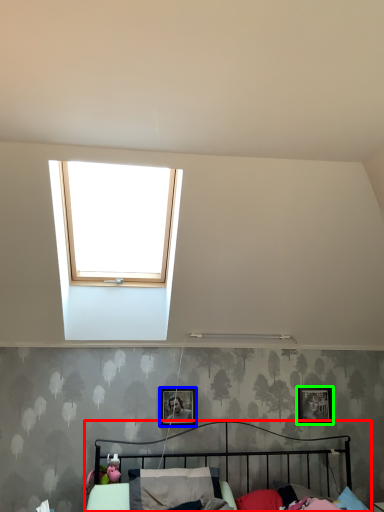
Question: Estimate the real-world distances between objects in this image. Which object is farther from bed (highlighted by a red box), picture frame (highlighted by a blue box) or picture frame (highlighted by a green box)?

Choices:
 (A) picture frame
 (B) picture frame

Answer: (B)